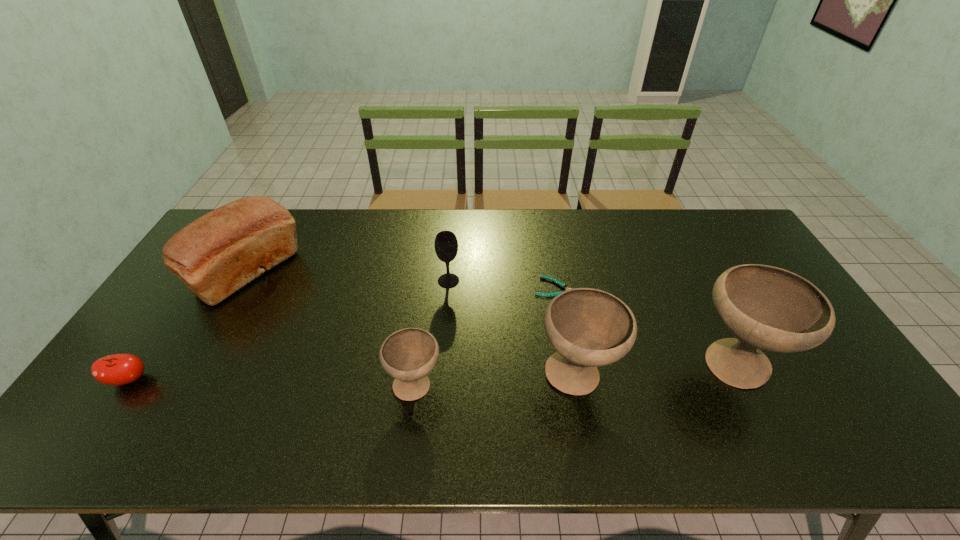
The width and height of the screenshot is (960, 540). Identify the location of object that is positioned at the far left corner. (216, 255).

Where is `object at the near left corner`? The height and width of the screenshot is (540, 960). object at the near left corner is located at coordinates (118, 369).

Find the location of a particular element. The image size is (960, 540). object at the near right corner is located at coordinates (767, 308).

Locate an element on the screen. The height and width of the screenshot is (540, 960). vacant area at the far edge of the desktop is located at coordinates 330,237.

You are a GUI agent. You are given a task and a screenshot of the screen. Output one action in this format:
    pyautogui.click(x=<x>, y=<y>)
    Task: Click on the vacant space at the near edge of the desktop
    The image size is (960, 540).
    Given the screenshot: What is the action you would take?
    pyautogui.click(x=686, y=395)

Where is `free spot between the shortest chalice and the second shortest chalice`? This screenshot has width=960, height=540. free spot between the shortest chalice and the second shortest chalice is located at coordinates click(x=496, y=381).

Where is `free space between the rightmost chalice and the shortest object`? This screenshot has width=960, height=540. free space between the rightmost chalice and the shortest object is located at coordinates 645,326.

This screenshot has height=540, width=960. In order to click on free space between the shortest chalice and the wineglass in this screenshot , I will do `click(432, 333)`.

This screenshot has width=960, height=540. Identify the location of free space between the second chalice from left to right and the apple. (353, 378).

What are the coordinates of `vacant region between the rightmost object and the bread` in the screenshot? It's located at (491, 319).